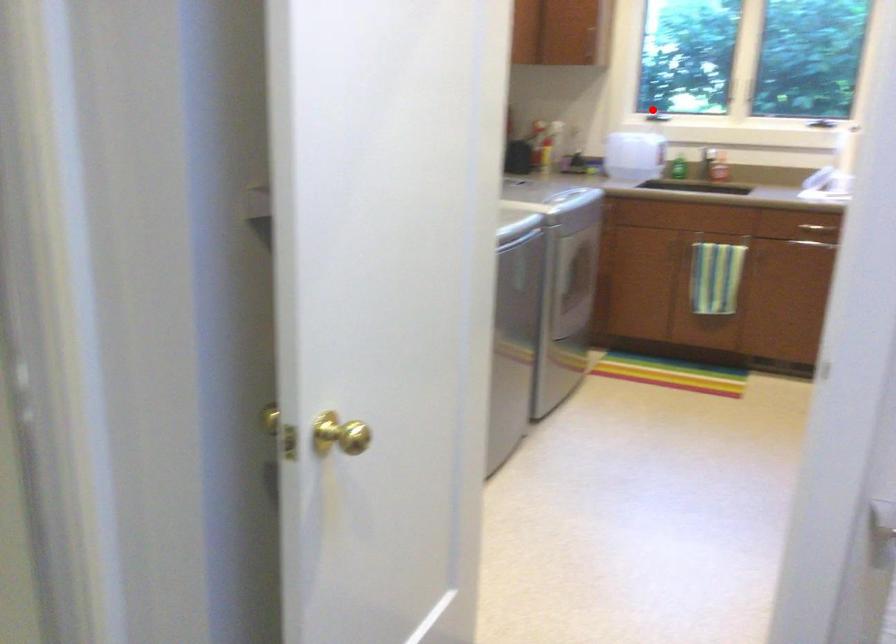
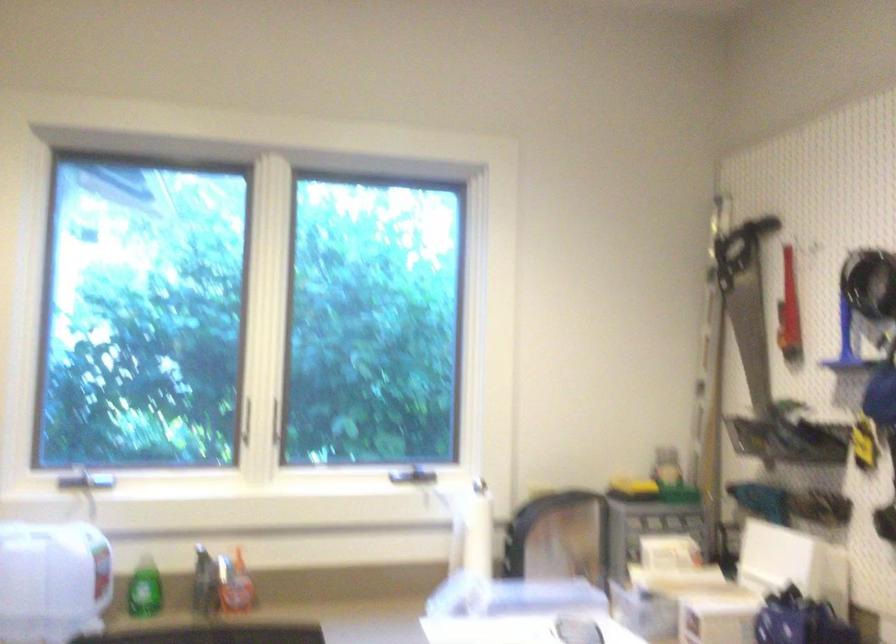
Where in the second image is the point corresponding to the highlighted location from the first image?

(84, 478)